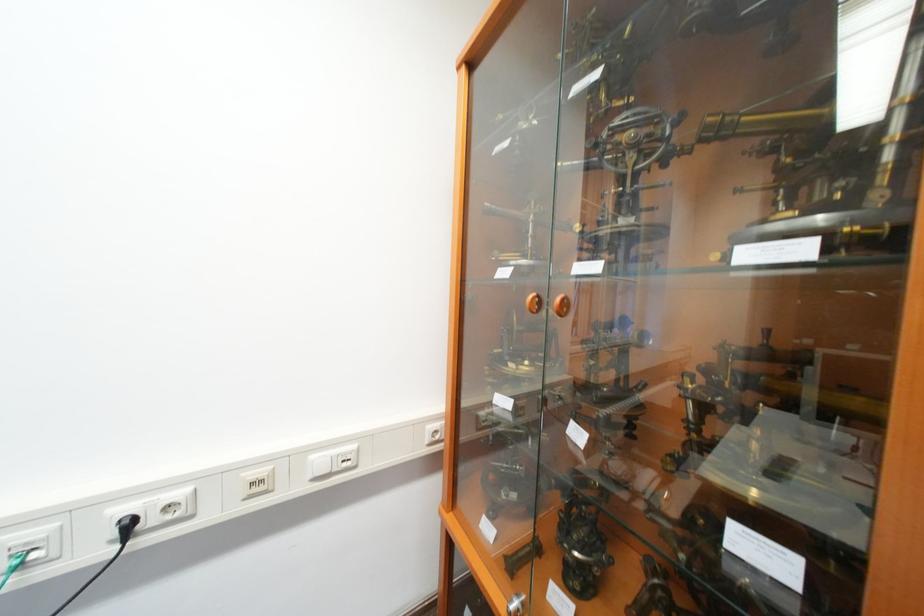
Where is `white power switch`? white power switch is located at coordinates (257, 482).